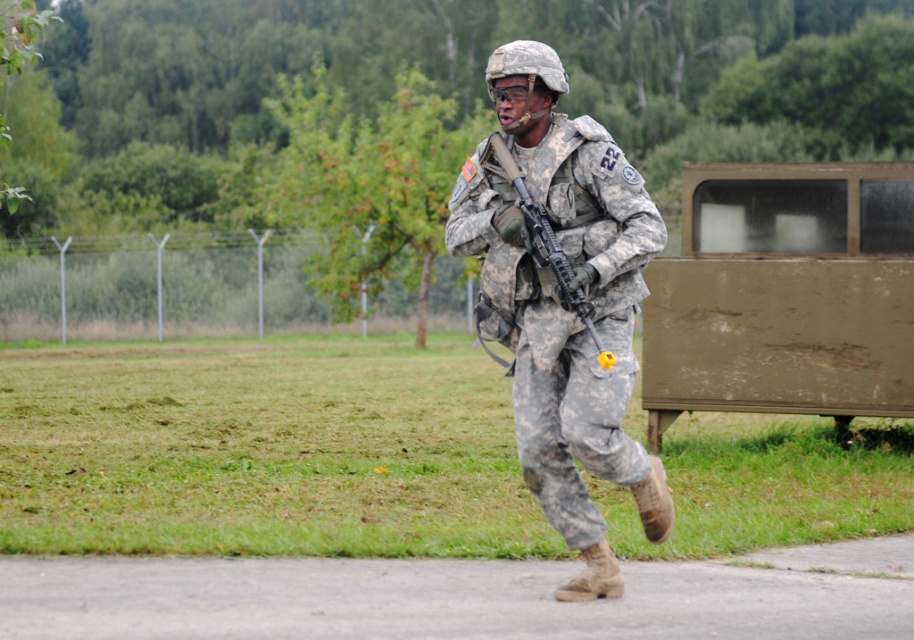
Can you confirm if camouflage uniform at center is positioned to the left of matte black rifle at center?

Incorrect, camouflage uniform at center is not on the left side of matte black rifle at center.

This screenshot has height=640, width=914. What are the coordinates of `camouflage uniform at center` in the screenshot? It's located at (562, 300).

Between point (582, 433) and point (567, 282), which one is positioned behind?

Point (582, 433)

You are a GUI agent. You are given a task and a screenshot of the screen. Output one action in this format:
    pyautogui.click(x=<x>, y=<y>)
    Task: Click on the camouflage uniform at center
    
    Given the screenshot: What is the action you would take?
    pyautogui.click(x=562, y=300)